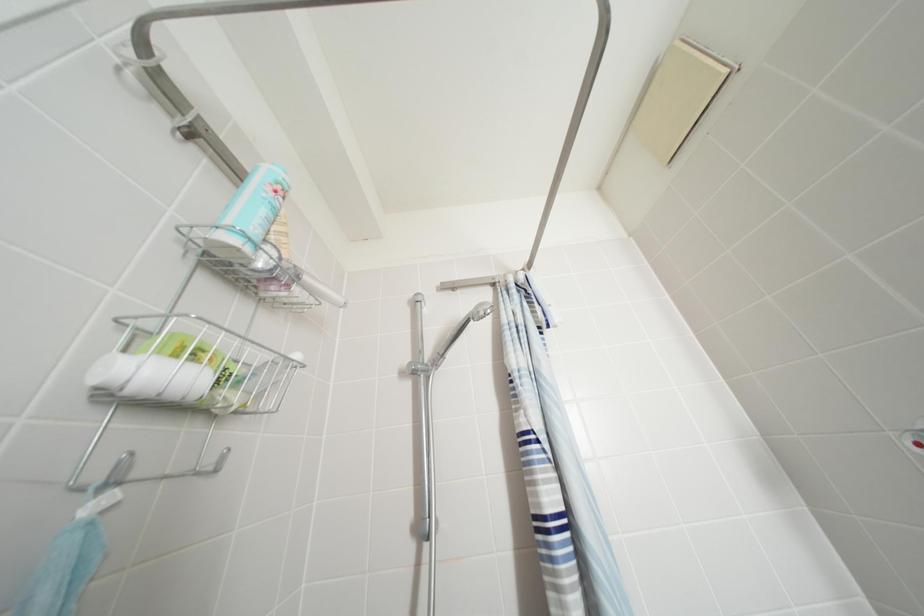
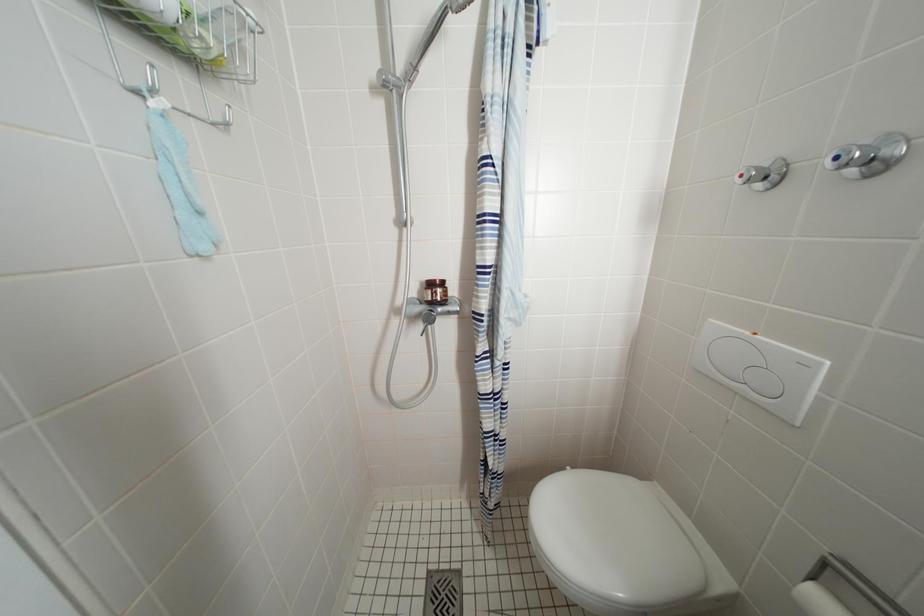
Question: Based on the continuous images, in which direction is the camera rotating? Reply with the corresponding letter.

Choices:
 (A) Left
 (B) Right
 (C) Up
 (D) Down

Answer: (D)